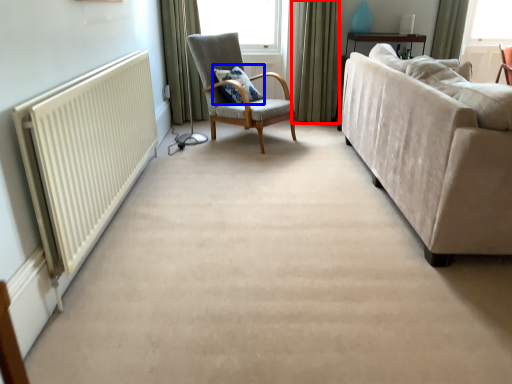
Question: Which point is closer to the camera, curtain (highlighted by a red box) or pillow (highlighted by a blue box)?

Choices:
 (A) curtain
 (B) pillow

Answer: (B)